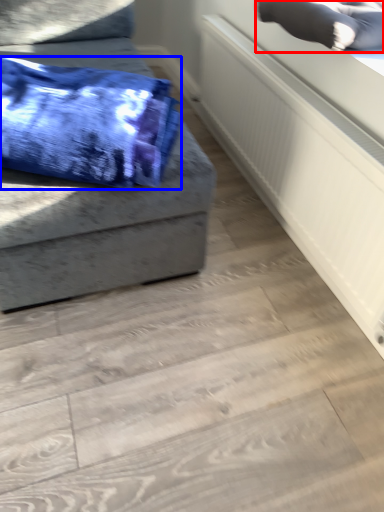
Question: Which point is closer to the camera, pillow (highlighted by a red box) or blanket (highlighted by a blue box)?

Choices:
 (A) pillow
 (B) blanket

Answer: (B)